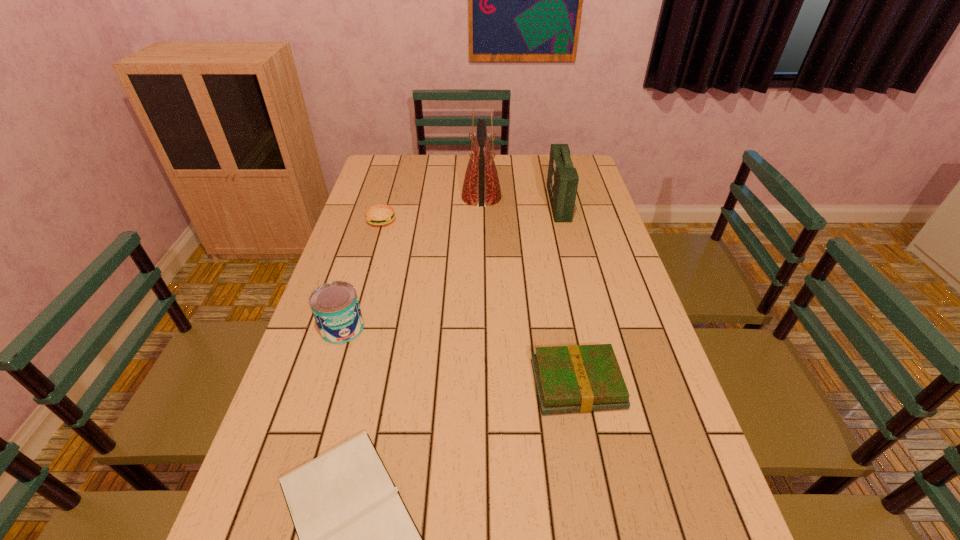
I want to click on object that is the fifth closest to the patty, so click(x=356, y=538).

Image resolution: width=960 pixels, height=540 pixels. What are the coordinates of `free space that satisfies the following two spatial constraints: 1. on the back side of the fourth farthest object; 2. on the left side of the patty` in the screenshot? It's located at (375, 220).

The image size is (960, 540). Identify the location of vacant space that satisfies the following two spatial constraints: 1. on the back side of the patty; 2. on the right side of the fourth farthest object. (375, 220).

This screenshot has height=540, width=960. I want to click on free spot that satisfies the following two spatial constraints: 1. on the back side of the patty; 2. on the left side of the tallest object, so click(x=388, y=197).